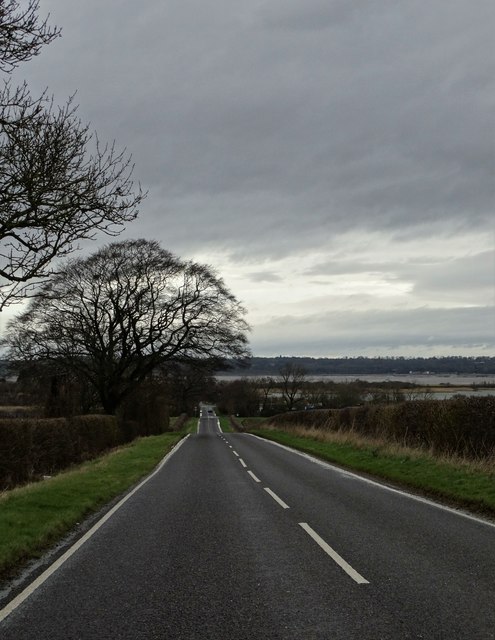
At what (x,y) coordinates should I click in order to perform the action: click on green plants. Please return your answer as a coordinate pair (x, y). Looking at the image, I should click on (44, 431), (427, 420).